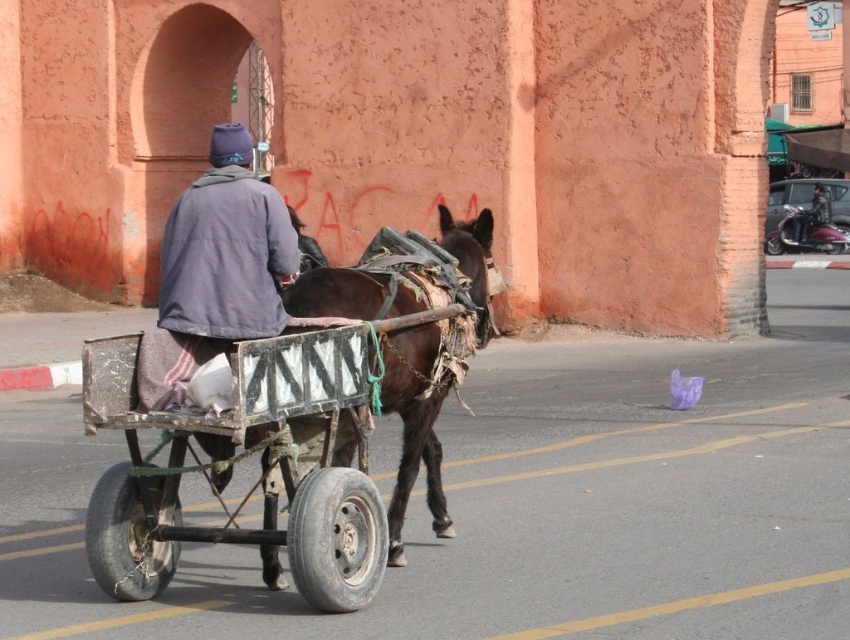
The image size is (850, 640). What are the coordinates of `brown leather donkey at center` in the screenshot? It's located at (414, 426).

Consider the image. Does brown leather donkey at center have a smaller size compared to metallic helmet at upper right?

Indeed, brown leather donkey at center has a smaller size compared to metallic helmet at upper right.

Does point (418, 304) lie behind point (809, 205)?

No.

The height and width of the screenshot is (640, 850). In order to click on brown leather donkey at center in this screenshot , I will do `click(414, 426)`.

Which is more to the left, rusty metal cart at center or metallic helmet at upper right?

Positioned to the left is rusty metal cart at center.

Can you confirm if rusty metal cart at center is positioned to the right of metallic helmet at upper right?

In fact, rusty metal cart at center is to the left of metallic helmet at upper right.

I want to click on rusty metal cart at center, so click(x=224, y=461).

Does rusty metal cart at center have a greater height compared to brown leather donkey at center?

No.

Consider the image. Is rusty metal cart at center behind brown leather donkey at center?

No, rusty metal cart at center is closer to the viewer.

Does point (346, 520) come farther from viewer compared to point (408, 360)?

No, it is in front of (408, 360).

At what (x,y) coordinates should I click in order to perform the action: click on rusty metal cart at center. Please return your answer as a coordinate pair (x, y). Looking at the image, I should click on (224, 461).